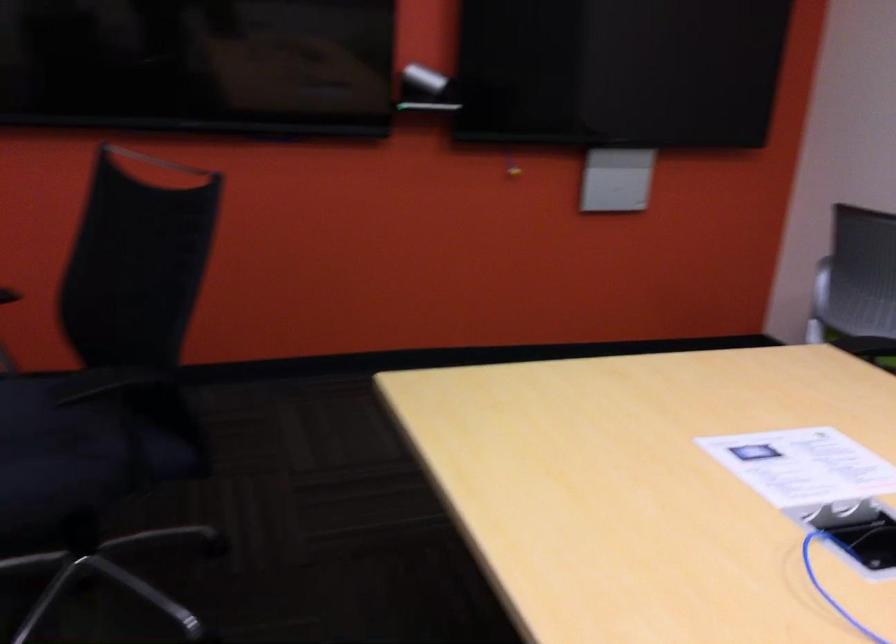
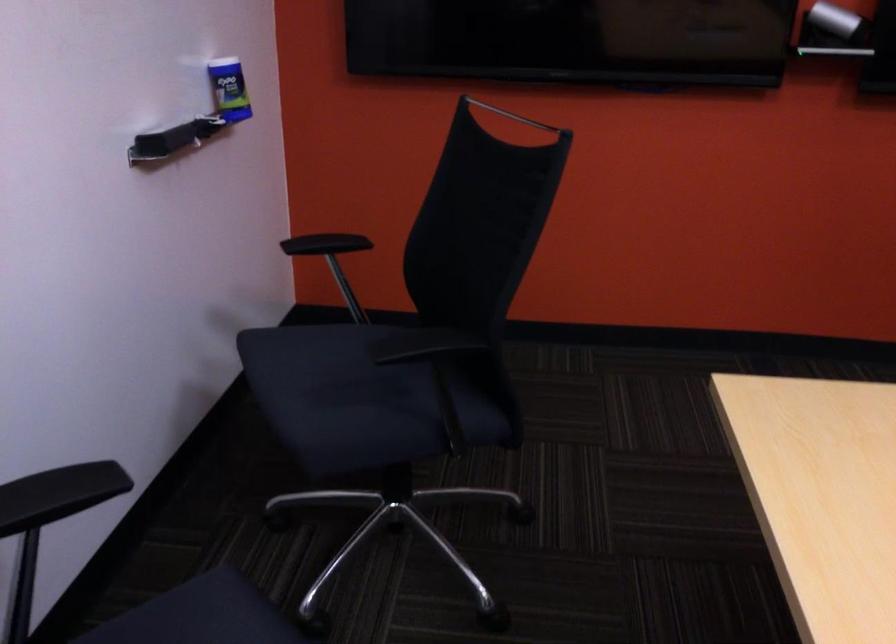
Question: The images are taken continuously from a first-person perspective. In which direction is your viewpoint rotating?

Choices:
 (A) Left
 (B) Right
 (C) Up
 (D) Down

Answer: (A)